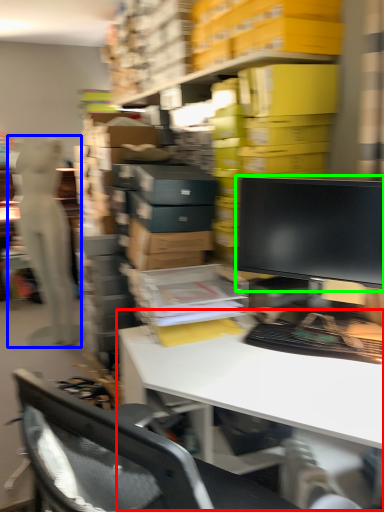
Question: Estimate the real-world distances between objects in this image. Which object is farther from desk (highlighted by a red box), person (highlighted by a blue box) or computer monitor (highlighted by a green box)?

Choices:
 (A) person
 (B) computer monitor

Answer: (A)